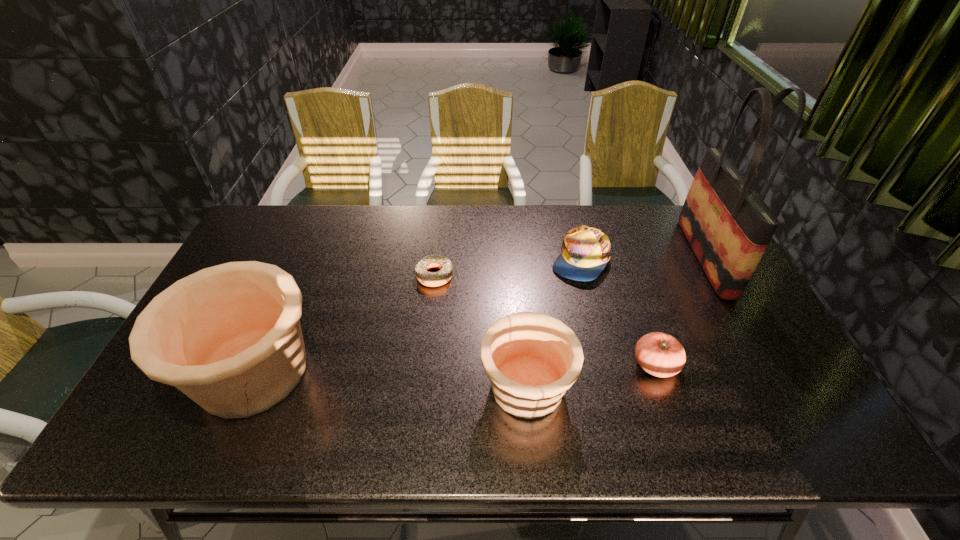
Observe the arrangement of all potterys in the image. To keep them evenly spaced, where would you place another pottery on the right? Please locate a free space. Please provide its 2D coordinates. Your answer should be formatted as a tuple, i.e. [(x, y)], where the tuple contains the x and y coordinates of a point satisfying the conditions above.

[(817, 403)]